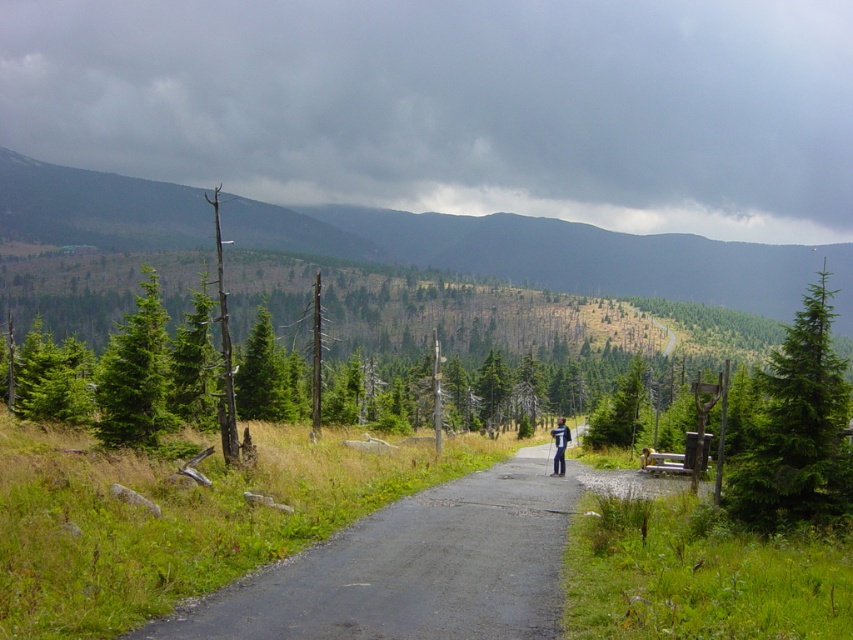
Can you confirm if green forested mountain at upper center is wider than green matte tree at left?

Yes.

Is green forested mountain at upper center below green matte tree at left?

A: No.

Who is more distant from viewer, (x=54, y=172) or (x=140, y=358)?

Positioned behind is point (x=54, y=172).

The width and height of the screenshot is (853, 640). I want to click on green forested mountain at upper center, so click(554, 253).

Can you confirm if green matte tree at right is positioned below green matte tree at left?

Correct, green matte tree at right is located below green matte tree at left.

Does green matte tree at right have a larger size compared to green matte tree at left?

No.

The height and width of the screenshot is (640, 853). In order to click on green matte tree at right in this screenshot , I will do `click(798, 428)`.

Locate an element on the screen. green forested mountain at upper center is located at coordinates (554, 253).

Consider the image. Is green forested mountain at upper center below asphalt road at center?

No.

Which is behind, point (123, 195) or point (575, 467)?

Point (123, 195)

You are a GUI agent. You are given a task and a screenshot of the screen. Output one action in this format:
    pyautogui.click(x=<x>, y=<y>)
    Task: Click on the green forested mountain at upper center
    This screenshot has height=640, width=853.
    Given the screenshot: What is the action you would take?
    pyautogui.click(x=554, y=253)